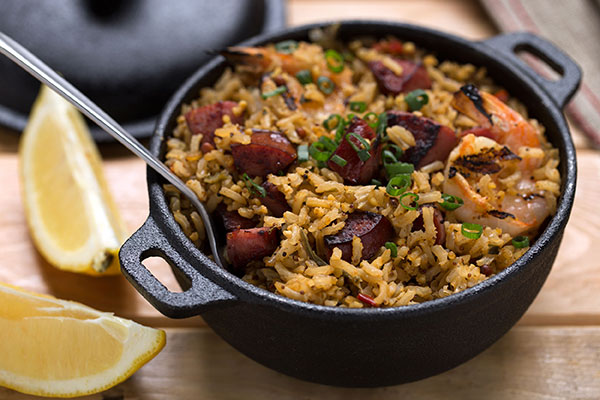
Find the location of `handle of utensil`. handle of utensil is located at coordinates 107,130.